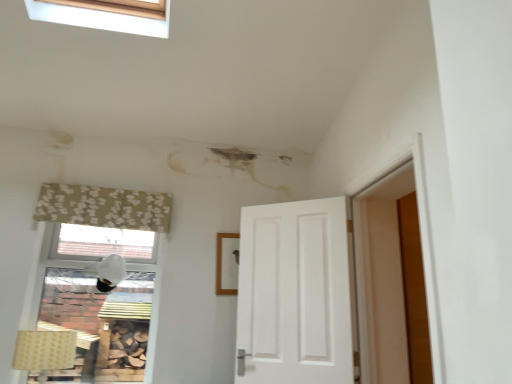
Question: Considering their positions, is yellow fabric lampshade at lower left, which is counted as the 1th lamp, starting from the front, located in front of or behind beige floral fabric curtain at upper left?

Choices:
 (A) behind
 (B) front

Answer: (B)

Question: Does point pyautogui.click(x=16, y=350) appear closer or farther from the camera than point pyautogui.click(x=135, y=213)?

Choices:
 (A) closer
 (B) farther

Answer: (A)

Question: Which of these objects is positioned farthest from the beige floral fabric curtain at upper left?

Choices:
 (A) white matte lampshade at upper left, the 2th lamp from the bottom
 (B) yellow fabric lampshade at lower left, which is counted as the first lamp, starting from the left

Answer: (B)

Question: Estimate the real-world distances between objects in this image. Which object is farther from the yellow fabric lampshade at lower left, which is the 1th lamp in bottom-to-top order?

Choices:
 (A) white matte lampshade at upper left, the 2th lamp from the bottom
 (B) beige floral fabric curtain at upper left

Answer: (B)